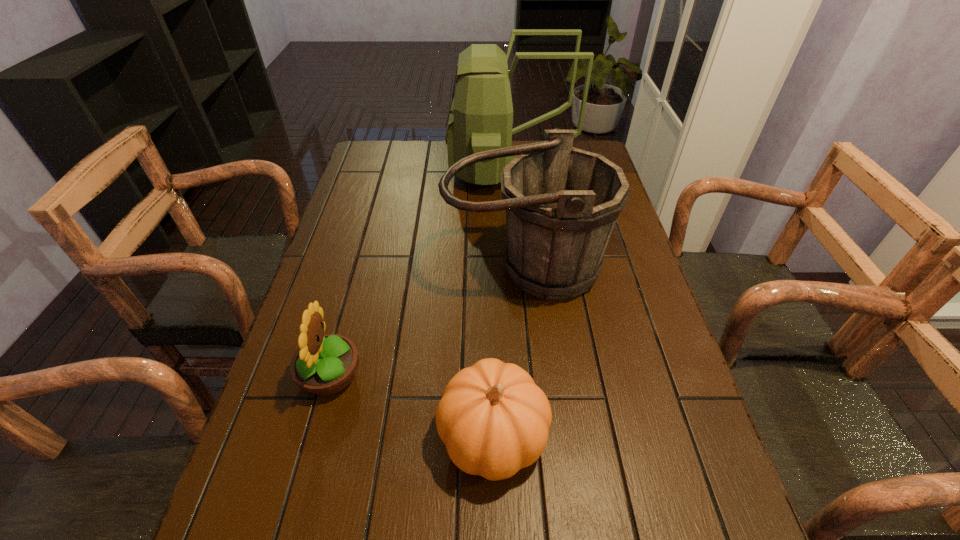
Find the location of a particular element. the tallest object is located at coordinates (480, 118).

This screenshot has width=960, height=540. I want to click on the farthest object, so click(480, 118).

What are the coordinates of `bucket` in the screenshot? It's located at (562, 203).

Image resolution: width=960 pixels, height=540 pixels. Find the location of `the third shortest object`. the third shortest object is located at coordinates (562, 203).

You are a GUI agent. You are given a task and a screenshot of the screen. Output one action in this format:
    pyautogui.click(x=<x>, y=<y>)
    Task: Click on the leftmost object
    The height and width of the screenshot is (540, 960).
    Given the screenshot: What is the action you would take?
    point(324,365)

The image size is (960, 540). I want to click on pumpkin, so click(x=494, y=420).

This screenshot has width=960, height=540. I want to click on vacant space located 0.150m on the front pocket of the backpack, so click(406, 171).

The height and width of the screenshot is (540, 960). What are the coordinates of `vacant area situated on the front pocket of the backpack` in the screenshot? It's located at (409, 171).

At what (x,y) coordinates should I click in order to perform the action: click on blank area located on the front pocket of the backpack. Please return your answer as a coordinate pair (x, y). The height and width of the screenshot is (540, 960). Looking at the image, I should click on (367, 171).

The height and width of the screenshot is (540, 960). What are the coordinates of `vacant space located on the handle side of the third nearest object` in the screenshot? It's located at (542, 447).